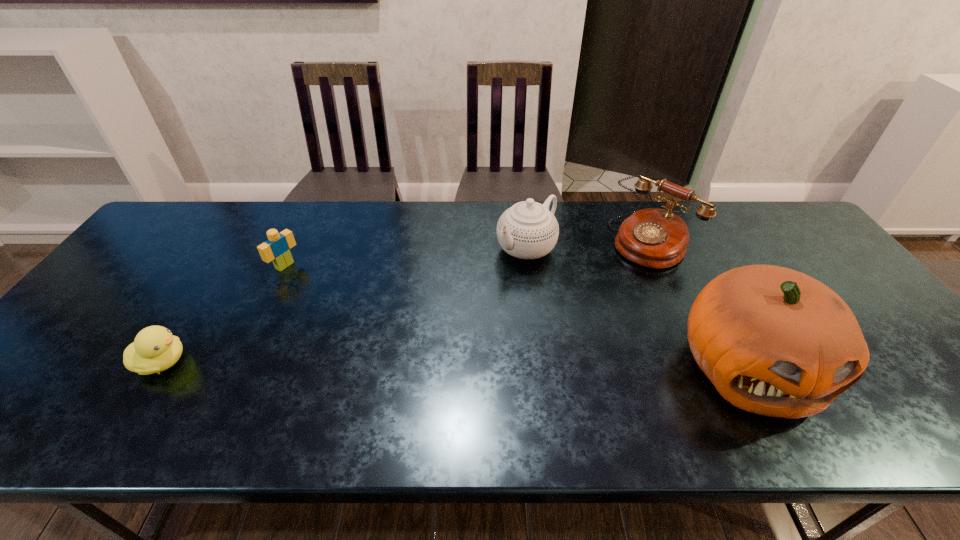
Identify the location of vacant space on the desktop that is between the duckling and the pumpkin and is positioned on the spout of the third object from right to left. The image size is (960, 540). (372, 363).

This screenshot has width=960, height=540. What are the coordinates of `vacant space on the desktop that is between the shortest object and the tallest object and is positioned on the face of the Lego` in the screenshot? It's located at (463, 364).

Find the location of a particular element. vacant space on the desktop that is between the shortest object and the tallest object and is positioned on the dial of the telephone is located at coordinates (513, 364).